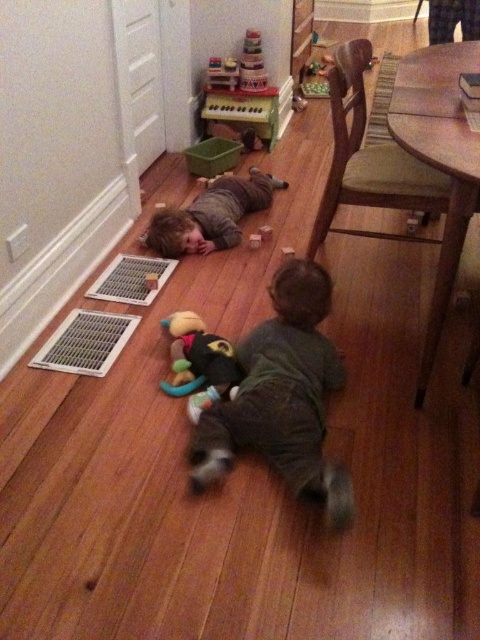
This screenshot has height=640, width=480. Identify the location of dark gray soft toddler at center. (282, 396).

Can you confirm if dark gray soft toddler at center is positioned below soft plush toy at center?

Correct, dark gray soft toddler at center is located below soft plush toy at center.

Where is `dark gray soft toddler at center`? The image size is (480, 640). dark gray soft toddler at center is located at coordinates (282, 396).

The image size is (480, 640). I want to click on dark gray soft toddler at center, so click(x=282, y=396).

Which is more to the left, matte gray shirt at center or soft plush toy at center?

soft plush toy at center is more to the left.

Who is taller, matte gray shirt at center or soft plush toy at center?

matte gray shirt at center is taller.

Which is in front, point (168, 212) or point (223, 346)?

Point (223, 346) is in front.

The height and width of the screenshot is (640, 480). In order to click on matte gray shirt at center in this screenshot , I will do `click(211, 216)`.

Which is behind, point (226, 472) or point (240, 212)?

The point (240, 212) is behind.

Can you confirm if dark gray soft toddler at center is positioned above matte gray shirt at center?

No, dark gray soft toddler at center is not above matte gray shirt at center.

Image resolution: width=480 pixels, height=640 pixels. I want to click on dark gray soft toddler at center, so click(x=282, y=396).

Find the location of a particular element. The height and width of the screenshot is (640, 480). dark gray soft toddler at center is located at coordinates (282, 396).